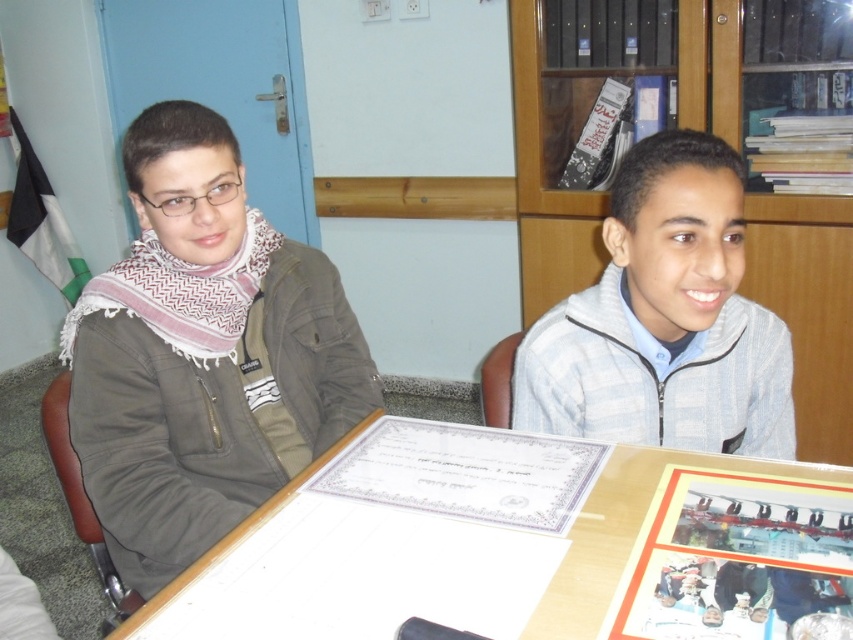
Is matte green jacket at left thinner than light gray zip-up sweater at right?

In fact, matte green jacket at left might be wider than light gray zip-up sweater at right.

Is matte green jacket at left smaller than light gray zip-up sweater at right?

Incorrect, matte green jacket at left is not smaller in size than light gray zip-up sweater at right.

Is point (345, 413) closer to viewer compared to point (570, 332)?

No.

The image size is (853, 640). Identify the location of matte green jacket at left. (202, 355).

Locate an element on the screen. white paper at center is located at coordinates (523, 545).

Between white paper at center and light gray zip-up sweater at right, which one is positioned lower?

Positioned lower is white paper at center.

Measure the distance between point (728, 596) and camera.

Point (728, 596) and camera are 31.68 inches apart.

Locate an element on the screen. This screenshot has width=853, height=640. white paper at center is located at coordinates [x=523, y=545].

Between white paper at center and matte green jacket at left, which one appears on the right side from the viewer's perspective?

white paper at center is more to the right.

Between point (717, 595) and point (318, 356), which one is positioned behind?

The point (318, 356) is behind.

This screenshot has width=853, height=640. I want to click on white paper at center, so click(523, 545).